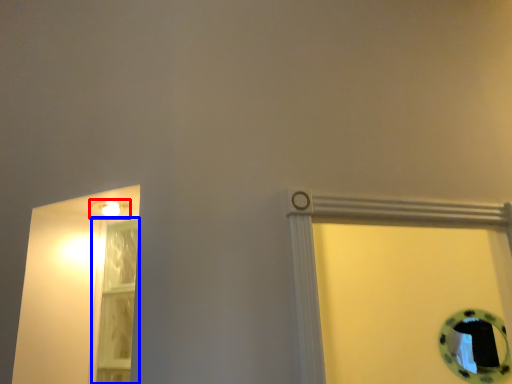
Question: Which point is closer to the camera, light fixture (highlighted by a red box) or glass door (highlighted by a blue box)?

Choices:
 (A) light fixture
 (B) glass door

Answer: (A)